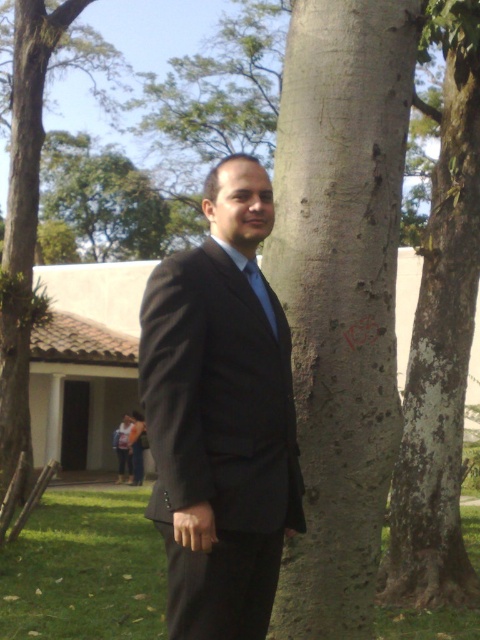
Can you confirm if smooth bark tree trunk at center is shorter than matte black suit at center?

In fact, smooth bark tree trunk at center may be taller than matte black suit at center.

Between smooth bark tree trunk at center and matte black suit at center, which one has less height?

matte black suit at center

You are a GUI agent. You are given a task and a screenshot of the screen. Output one action in this format:
    pyautogui.click(x=<x>, y=<y>)
    Task: Click on the smooth bark tree trunk at center
    The image size is (480, 640).
    Given the screenshot: What is the action you would take?
    pyautogui.click(x=340, y=292)

Is matte black suit at center taller than white textured bark at center?

Yes.

Does matte black suit at center have a greater width compared to white textured bark at center?

Indeed, matte black suit at center has a greater width compared to white textured bark at center.

Is point (187, 426) positioned in front of point (470, 202)?

Yes, point (187, 426) is closer to viewer.

The image size is (480, 640). I want to click on matte black suit at center, so click(x=219, y=417).

Does white textured bark at center appear under blue satin tie at center?

No.

Describe the element at coordinates (441, 342) in the screenshot. I see `white textured bark at center` at that location.

Locate an element on the screen. white textured bark at center is located at coordinates (441, 342).